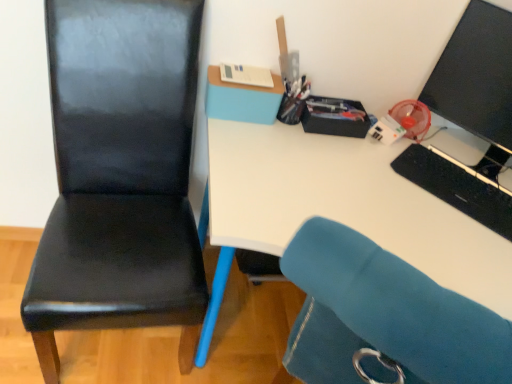
What are the coordinates of `free point below black glossy monitor at upper right (from a real-world perspective)` in the screenshot? It's located at (476, 162).